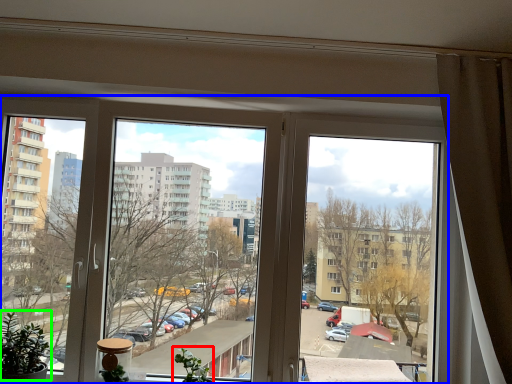
Question: Estimate the real-world distances between objects in this image. Which object is closer to plant (highlighted by a red box), window (highlighted by a blue box) or plant (highlighted by a green box)?

Choices:
 (A) window
 (B) plant

Answer: (B)